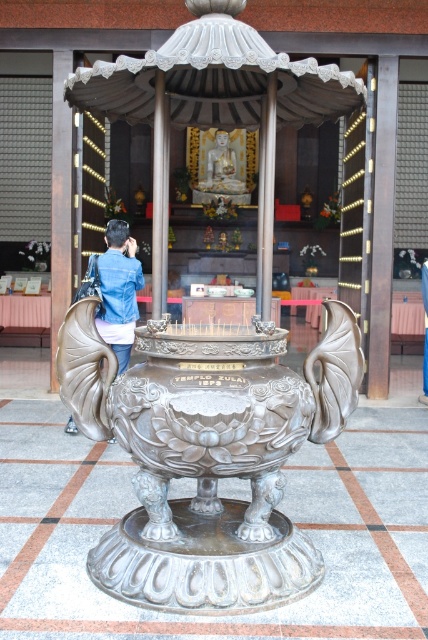
You are a visitor to the temple and want to place your denim jacket on the white marble statue at center. Considering their sizes, will the denim jacket at left fit on the statue?

The denim jacket at left is narrower than the white marble statue at center, so it should fit on the statue.

You are a temple visitor who just entered the main hall and see the denim jacket at left and the white marble statue at center. Which object is closer to you?

The denim jacket at left is closer to you because it is in front of the white marble statue at center.

You are an interior designer planning to place a new decorative item between the polished silver sculpture at center and the white marble statue at center. To ensure proper spacing, you need to know which one is wider. Which object has a greater width?

The polished silver sculpture at center has a greater width than the white marble statue at center according to the description.